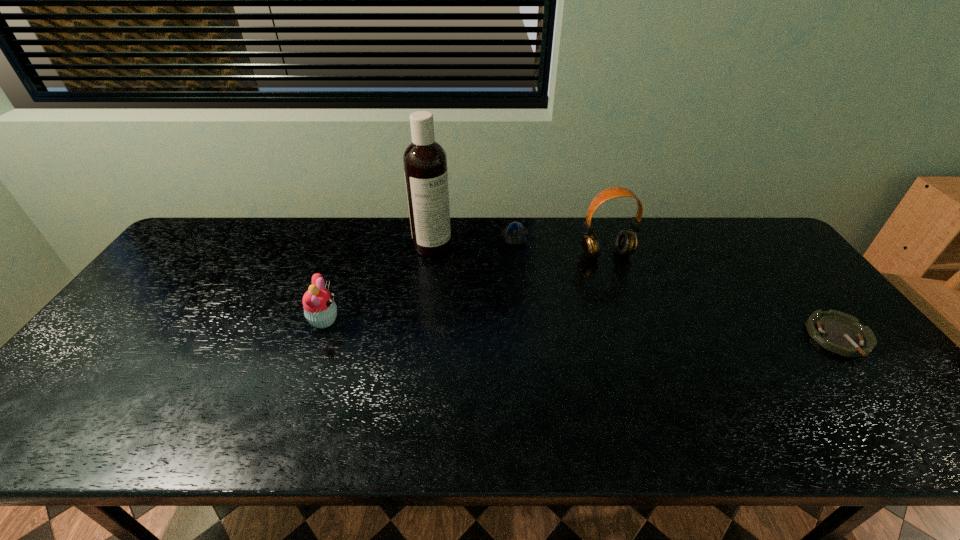
Identify which object is located as the nearest to the second object from right to left. Please provide its 2D coordinates. Your answer should be formatted as a tuple, i.e. [(x, y)], where the tuple contains the x and y coordinates of a point satisfying the conditions above.

[(515, 234)]

Locate an element on the screen. Image resolution: width=960 pixels, height=540 pixels. vacant space that satisfies the following two spatial constraints: 1. on the front side of the fourth object from left to right; 2. on the right side of the second object from left to right is located at coordinates (431, 254).